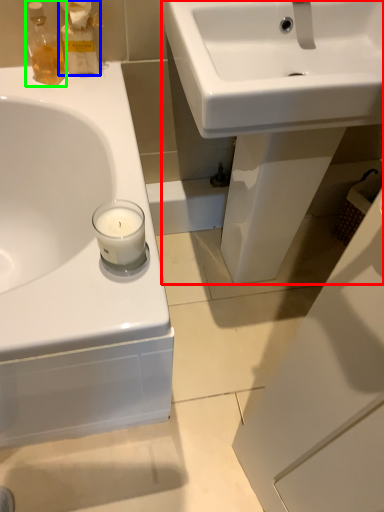
Question: Based on their relative distances, which object is farther from sink (highlighted by a red box)? Choose from cleaning product (highlighted by a blue box) and toiletry (highlighted by a green box).

Choices:
 (A) cleaning product
 (B) toiletry

Answer: (B)